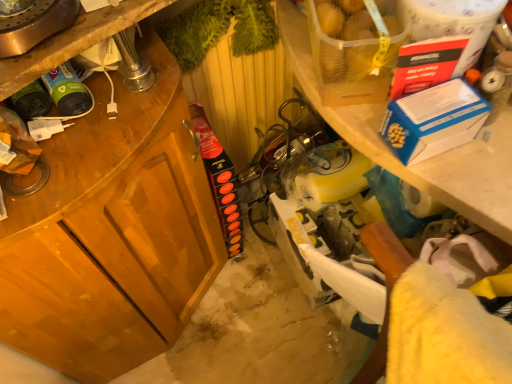
Question: Relative to translucent plastic bag of potatoes at upper right, is wooden cabinet at left in front or behind?

Choices:
 (A) behind
 (B) front

Answer: (A)

Question: From the image's perspective, is wooden cabinet at left above or below translucent plastic bag of potatoes at upper right?

Choices:
 (A) above
 (B) below

Answer: (B)

Question: Which object is the closest to the wooden cabinet at left?

Choices:
 (A) translucent plastic bag of potatoes at upper right
 (B) blue cardboard box at upper right
 (C) white plastic shelf at upper right

Answer: (C)

Question: Which of these objects is positioned farthest from the white plastic shelf at upper right?

Choices:
 (A) blue cardboard box at upper right
 (B) wooden cabinet at left
 (C) translucent plastic bag of potatoes at upper right

Answer: (B)